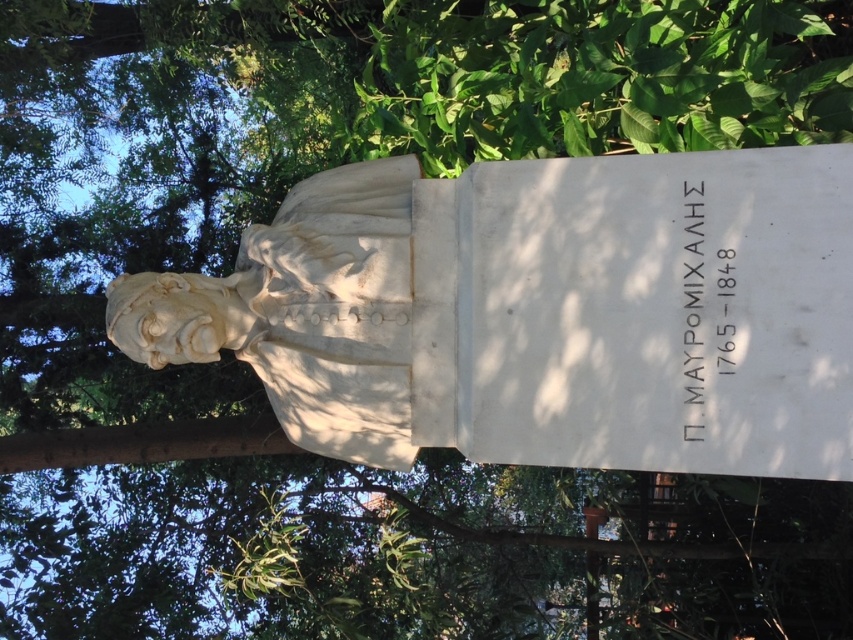
Between white marble bust at left and white stone inscription at center, which one has more height?

white marble bust at left

Which is below, white marble bust at left or white stone inscription at center?

white stone inscription at center

Who is more forward, (809, 324) or (711, 369)?

Point (809, 324)

The width and height of the screenshot is (853, 640). Identify the location of white marble bust at left. (543, 312).